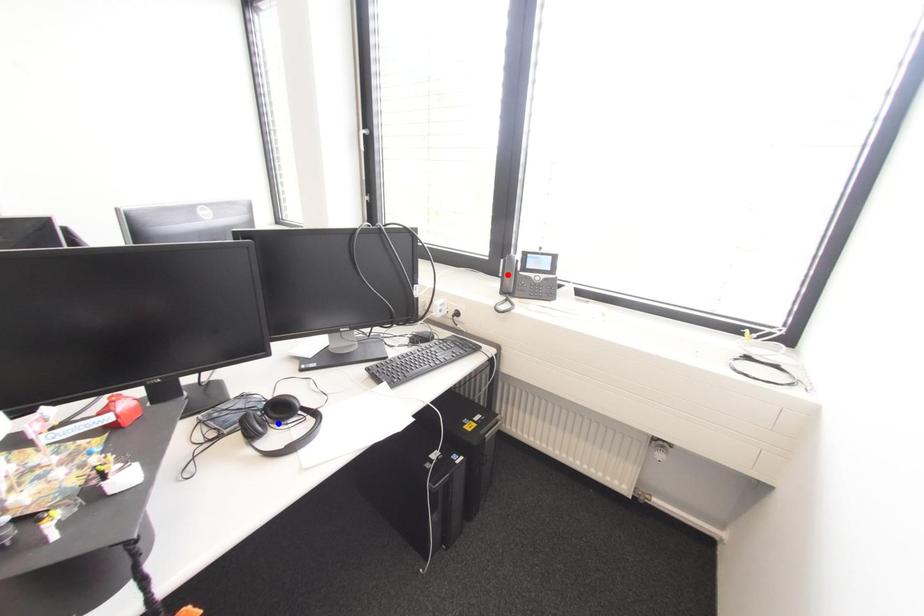
Question: In the image, two points are highlighted. Which point is nearer to the camera? Reply with the corresponding letter.

Choices:
 (A) blue point
 (B) red point

Answer: (A)